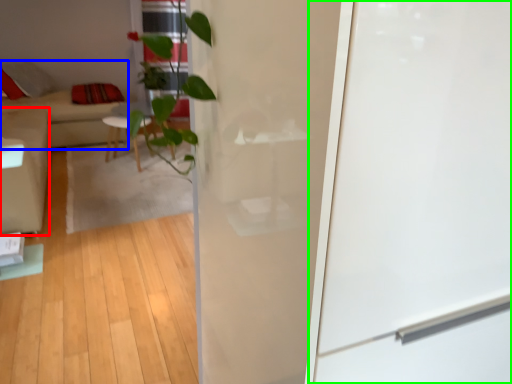
Question: Which object is positioned farthest from armchair (highlighted by a red box)? Select from couch (highlighted by a blue box) and screen door (highlighted by a green box).

Choices:
 (A) couch
 (B) screen door

Answer: (B)